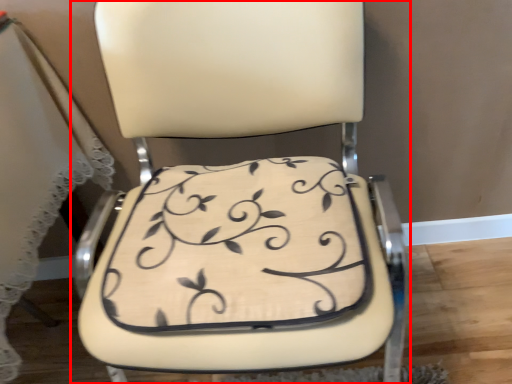
Question: From the image's perspective, where is chair (annotated by the red box) located in relation to pillow in the image?

Choices:
 (A) above
 (B) below

Answer: (A)